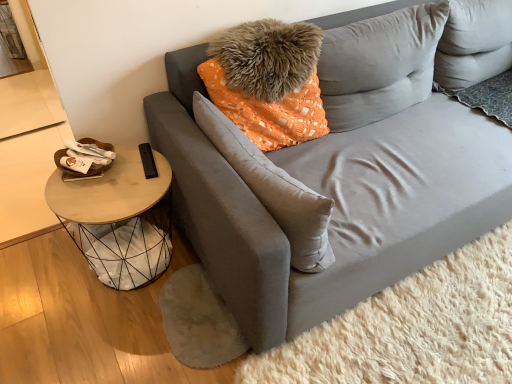
Find the location of a particular element. The height and width of the screenshot is (384, 512). vacant position to the left of woodenmaterial/texture side table at left is located at coordinates (42, 277).